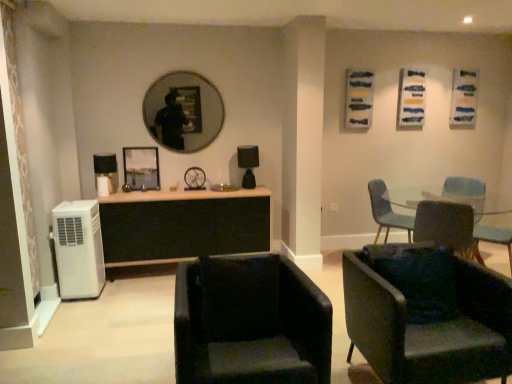
Question: Is matte black mirror at upper center surrounded by black leather chair at lower center, which ranks as the first chair in front-to-back order?

Choices:
 (A) yes
 (B) no

Answer: (B)

Question: Considering the relative positions of black leather chair at lower center, which ranks as the first chair in front-to-back order, and matte black mirror at upper center in the image provided, is black leather chair at lower center, which ranks as the first chair in front-to-back order, in front of matte black mirror at upper center?

Choices:
 (A) yes
 (B) no

Answer: (A)

Question: From a real-world perspective, is black leather chair at lower center, which ranks as the first chair in front-to-back order, positioned under matte black mirror at upper center based on gravity?

Choices:
 (A) yes
 (B) no

Answer: (A)

Question: Does black leather chair at lower center, which ranks as the first chair in front-to-back order, have a lesser width compared to matte black mirror at upper center?

Choices:
 (A) no
 (B) yes

Answer: (A)

Question: Does black leather chair at lower center, which ranks as the first chair in front-to-back order, have a greater width compared to matte black mirror at upper center?

Choices:
 (A) yes
 (B) no

Answer: (A)

Question: From their relative heights in the image, would you say matte black lamp at center is taller or shorter than black leather chair at lower center, which ranks as the first chair in front-to-back order?

Choices:
 (A) tall
 (B) short

Answer: (B)

Question: From the image's perspective, is matte black lamp at center above or below black leather chair at lower center, which ranks as the first chair in front-to-back order?

Choices:
 (A) above
 (B) below

Answer: (A)

Question: Considering the positions of matte black lamp at center and black leather chair at lower center, which ranks as the first chair in front-to-back order, in the image, is matte black lamp at center wider or thinner than black leather chair at lower center, which ranks as the first chair in front-to-back order,?

Choices:
 (A) wide
 (B) thin

Answer: (B)

Question: Would you say matte black lamp at center is inside or outside black leather chair at lower center, placed as the fourth chair when sorted from back to front?

Choices:
 (A) inside
 (B) outside

Answer: (B)

Question: Considering their positions, is white plastic air conditioner at lower left located in front of or behind teal fabric chair at center right, which appears as the fourth chair when viewed from the front?

Choices:
 (A) front
 (B) behind

Answer: (A)

Question: From a real-world perspective, is white plastic air conditioner at lower left above or below teal fabric chair at center right, the first chair when ordered from back to front?

Choices:
 (A) below
 (B) above

Answer: (A)

Question: Looking at their shapes, would you say white plastic air conditioner at lower left is wider or thinner than teal fabric chair at center right, the first chair when ordered from back to front?

Choices:
 (A) wide
 (B) thin

Answer: (B)

Question: Which is correct: white plastic air conditioner at lower left is inside teal fabric chair at center right, which appears as the fourth chair when viewed from the front, or outside of it?

Choices:
 (A) inside
 (B) outside

Answer: (B)

Question: Considering their positions, is teal fabric chair at center right, the first chair when ordered from back to front, located in front of or behind black leather chair at lower center, placed as the fourth chair when sorted from back to front?

Choices:
 (A) front
 (B) behind

Answer: (B)

Question: Would you say teal fabric chair at center right, which appears as the fourth chair when viewed from the front, is to the left or to the right of black leather chair at lower center, which ranks as the first chair in front-to-back order, in the picture?

Choices:
 (A) left
 (B) right

Answer: (B)